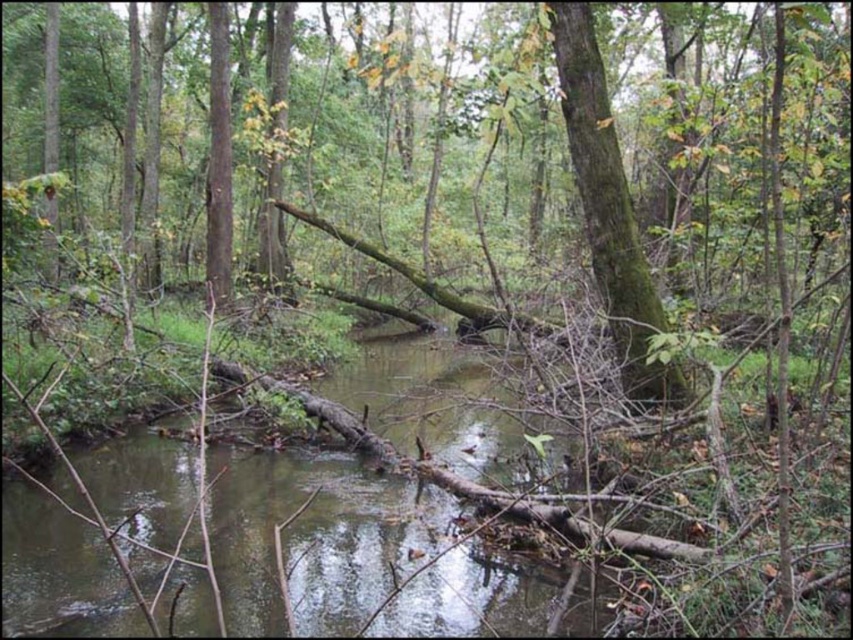
Question: Does brown wood stream at center have a greater width compared to green mossy tree trunk at center?

Choices:
 (A) yes
 (B) no

Answer: (B)

Question: Can you confirm if brown wood stream at center is positioned to the right of green mossy tree trunk at center?

Choices:
 (A) yes
 (B) no

Answer: (B)

Question: Which point is farther to the camera?

Choices:
 (A) brown wood stream at center
 (B) green mossy tree trunk at center

Answer: (B)

Question: Which point appears farthest from the camera in this image?

Choices:
 (A) (216, 552)
 (B) (651, 371)

Answer: (B)

Question: Which point appears farthest from the camera in this image?

Choices:
 (A) (519, 595)
 (B) (596, 163)

Answer: (B)

Question: Is brown wood stream at center in front of green mossy tree trunk at center?

Choices:
 (A) no
 (B) yes

Answer: (B)